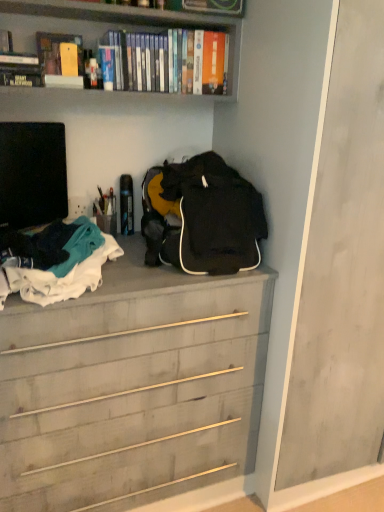
Question: Is matte yellow book at upper left, placed as the 3th book when sorted from left to right, facing away from black matte television at left?

Choices:
 (A) no
 (B) yes

Answer: (A)

Question: Is matte yellow book at upper left, placed as the 3th book when sorted from left to right, shorter than black matte television at left?

Choices:
 (A) yes
 (B) no

Answer: (A)

Question: From a real-world perspective, is matte yellow book at upper left, which is the 2th book in right-to-left order, under black matte television at left?

Choices:
 (A) no
 (B) yes

Answer: (A)

Question: Would you say matte yellow book at upper left, placed as the 3th book when sorted from left to right, contains black matte television at left?

Choices:
 (A) no
 (B) yes

Answer: (A)

Question: Does matte yellow book at upper left, placed as the 3th book when sorted from left to right, lie in front of black matte television at left?

Choices:
 (A) no
 (B) yes

Answer: (A)

Question: Which is correct: wooden chest of drawers at center is inside black matte backpack at center, or outside of it?

Choices:
 (A) outside
 (B) inside

Answer: (A)

Question: From the image's perspective, is wooden chest of drawers at center located above or below black matte backpack at center?

Choices:
 (A) below
 (B) above

Answer: (A)

Question: From a real-world perspective, is wooden chest of drawers at center positioned above or below black matte backpack at center?

Choices:
 (A) below
 (B) above

Answer: (A)

Question: Is point (147, 460) closer or farther from the camera than point (266, 227)?

Choices:
 (A) closer
 (B) farther

Answer: (B)

Question: From the image's perspective, is matte yellow book at upper left, placed as the 3th book when sorted from left to right, located above or below hardcover book at upper left, which appears as the fourth book when viewed from the right?

Choices:
 (A) below
 (B) above

Answer: (A)

Question: Choose the correct answer: Is matte yellow book at upper left, which is the 2th book in right-to-left order, inside hardcover book at upper left, which appears as the fourth book when viewed from the right, or outside it?

Choices:
 (A) outside
 (B) inside

Answer: (A)

Question: Is matte yellow book at upper left, which is the 2th book in right-to-left order, wider or thinner than hardcover book at upper left, which is the 1th book in left-to-right order?

Choices:
 (A) wide
 (B) thin

Answer: (A)

Question: In terms of height, does matte yellow book at upper left, placed as the 3th book when sorted from left to right, look taller or shorter compared to hardcover book at upper left, which appears as the fourth book when viewed from the right?

Choices:
 (A) tall
 (B) short

Answer: (A)

Question: Is white cotton clothes at left wider or thinner than hardcover books at upper center, which ranks as the first book in right-to-left order?

Choices:
 (A) thin
 (B) wide

Answer: (B)

Question: From the image's perspective, relative to hardcover books at upper center, which ranks as the first book in right-to-left order, is white cotton clothes at left above or below?

Choices:
 (A) below
 (B) above

Answer: (A)